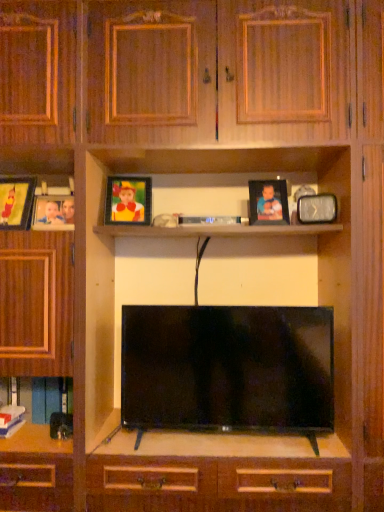
Question: From the image's perspective, is black glossy flat-screen tv at center on top of matte plastic picture frame at upper center, the 3th picture frame in the right-to-left sequence?

Choices:
 (A) no
 (B) yes

Answer: (A)

Question: Does black glossy flat-screen tv at center have a smaller size compared to matte plastic picture frame at upper center, which appears as the third picture frame when viewed from the left?

Choices:
 (A) yes
 (B) no

Answer: (B)

Question: From the image's perspective, is black glossy flat-screen tv at center located beneath matte plastic picture frame at upper center, the 3th picture frame in the right-to-left sequence?

Choices:
 (A) yes
 (B) no

Answer: (A)

Question: Is black glossy flat-screen tv at center looking in the opposite direction of matte plastic picture frame at upper center, the 3th picture frame in the right-to-left sequence?

Choices:
 (A) no
 (B) yes

Answer: (A)

Question: Does black glossy flat-screen tv at center lie behind matte plastic picture frame at upper center, which appears as the third picture frame when viewed from the left?

Choices:
 (A) yes
 (B) no

Answer: (B)

Question: Is hardcover book at lower left, positioned as the 2th book in front-to-back order, wider or thinner than matte plastic picture frame at upper center, the 3th picture frame in the right-to-left sequence?

Choices:
 (A) thin
 (B) wide

Answer: (A)

Question: Visually, is hardcover book at lower left, the 1th book when ordered from back to front, positioned to the left or to the right of matte plastic picture frame at upper center, which appears as the third picture frame when viewed from the left?

Choices:
 (A) right
 (B) left

Answer: (B)

Question: Do you think hardcover book at lower left, positioned as the 2th book in front-to-back order, is within matte plastic picture frame at upper center, the 3th picture frame in the right-to-left sequence, or outside of it?

Choices:
 (A) inside
 (B) outside

Answer: (B)

Question: Considering their positions, is hardcover book at lower left, the 1th book when ordered from back to front, located in front of or behind matte plastic picture frame at upper center, which appears as the third picture frame when viewed from the left?

Choices:
 (A) front
 (B) behind

Answer: (B)

Question: In the image, is matte black picture frame at upper center, positioned as the second picture frame in right-to-left order, positioned in front of or behind metallic rectangular clock at upper right, placed as the first picture frame when sorted from right to left?

Choices:
 (A) front
 (B) behind

Answer: (B)

Question: Is matte black picture frame at upper center, the fourth picture frame positioned from the left, bigger or smaller than metallic rectangular clock at upper right, placed as the first picture frame when sorted from right to left?

Choices:
 (A) small
 (B) big

Answer: (B)

Question: Considering the positions of matte black picture frame at upper center, positioned as the second picture frame in right-to-left order, and metallic rectangular clock at upper right, placed as the first picture frame when sorted from right to left, in the image, is matte black picture frame at upper center, positioned as the second picture frame in right-to-left order, wider or thinner than metallic rectangular clock at upper right, placed as the first picture frame when sorted from right to left,?

Choices:
 (A) wide
 (B) thin

Answer: (B)

Question: Is matte black picture frame at upper center, the fourth picture frame positioned from the left, taller or shorter than metallic rectangular clock at upper right, placed as the first picture frame when sorted from right to left?

Choices:
 (A) short
 (B) tall

Answer: (B)

Question: In terms of height, does blue paper book at lower left, which is counted as the 2th book, starting from the back, look taller or shorter compared to hardcover book at lower left, the 1th book when ordered from back to front?

Choices:
 (A) short
 (B) tall

Answer: (A)

Question: Considering their positions, is blue paper book at lower left, which appears as the first book when viewed from the front, located in front of or behind hardcover book at lower left, positioned as the 2th book in front-to-back order?

Choices:
 (A) front
 (B) behind

Answer: (A)